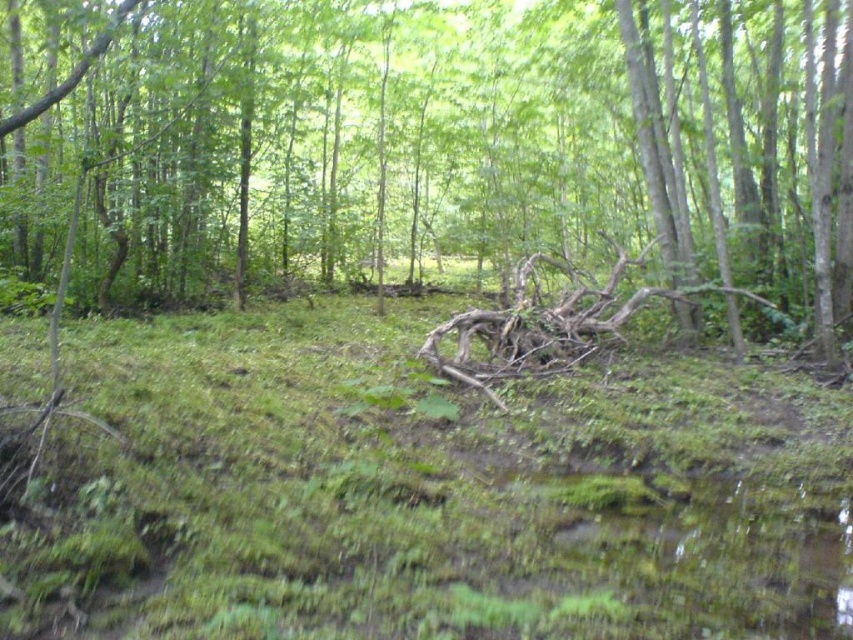
Question: Which object is farther from the camera taking this photo?

Choices:
 (A) brown rough branch at center
 (B) brown wood log at center

Answer: (A)

Question: Which point is closer to the camera taking this photo?

Choices:
 (A) (714, 141)
 (B) (527, 352)

Answer: (B)

Question: Does brown wood log at center have a smaller size compared to brown rough branch at center?

Choices:
 (A) yes
 (B) no

Answer: (B)

Question: Is brown wood log at center to the right of brown rough branch at center from the viewer's perspective?

Choices:
 (A) yes
 (B) no

Answer: (B)

Question: Can you confirm if brown wood log at center is thinner than brown rough branch at center?

Choices:
 (A) no
 (B) yes

Answer: (A)